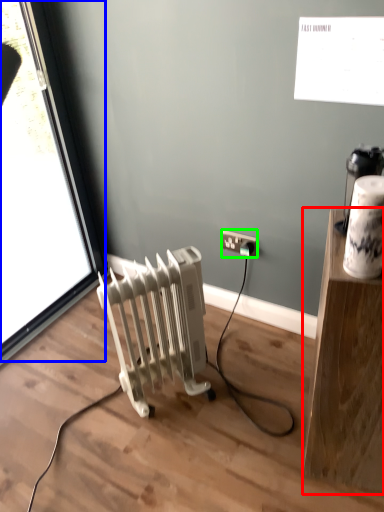
Question: Based on their relative distances, which object is farther from furniture (highlighted by a red box)? Choose from window (highlighted by a blue box) and power plugs and sockets (highlighted by a green box).

Choices:
 (A) window
 (B) power plugs and sockets

Answer: (A)